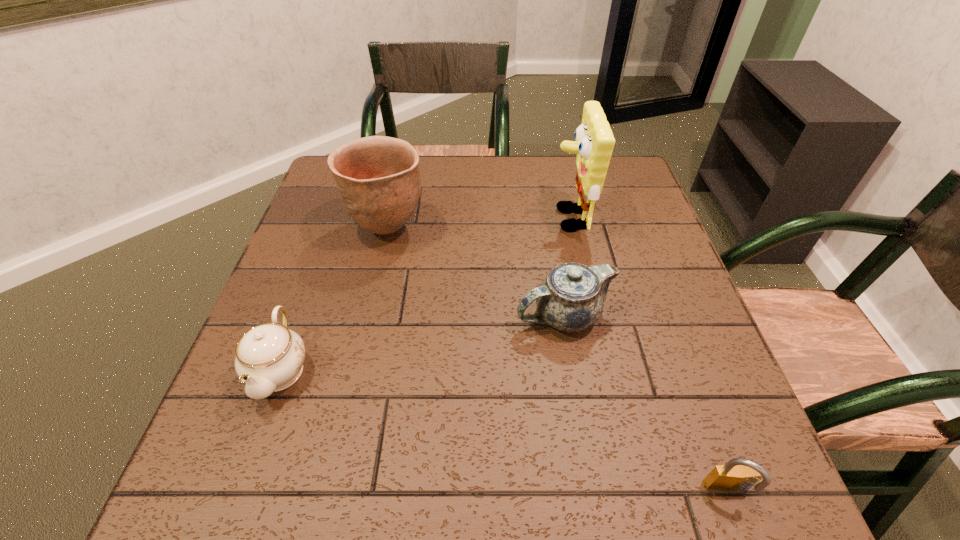
Locate an element on the screen. vacant area situated 0.130m from the spout of the right chinaware is located at coordinates (453, 315).

You are a GUI agent. You are given a task and a screenshot of the screen. Output one action in this format:
    pyautogui.click(x=<x>, y=<y>)
    Task: Click on the vacant space situated 0.400m from the spout of the right chinaware
    
    Given the screenshot: What is the action you would take?
    pyautogui.click(x=325, y=315)

Where is `free space located 0.390m from the spout of the right chinaware`? This screenshot has width=960, height=540. free space located 0.390m from the spout of the right chinaware is located at coordinates (330, 315).

You are a GUI agent. You are given a task and a screenshot of the screen. Output one action in this format:
    pyautogui.click(x=<x>, y=<y>)
    Task: Click on the free point located 0.070m at the spout of the left chinaware
    This screenshot has width=960, height=540.
    Given the screenshot: What is the action you would take?
    pyautogui.click(x=250, y=453)

Find the location of `object positioned at the far edge`. object positioned at the far edge is located at coordinates (594, 144).

The image size is (960, 540). In order to click on object located at the near edge in this screenshot , I will do `click(737, 474)`.

The width and height of the screenshot is (960, 540). In order to click on pottery that is at the left edge in this screenshot , I will do `click(378, 178)`.

Find the location of a particular element. The width and height of the screenshot is (960, 540). chinaware that is positioned at the left edge is located at coordinates (269, 357).

Locate an element on the screen. object present at the right edge is located at coordinates (737, 474).

Locate an element on the screen. Image resolution: width=960 pixels, height=540 pixels. object present at the near right corner is located at coordinates (737, 474).